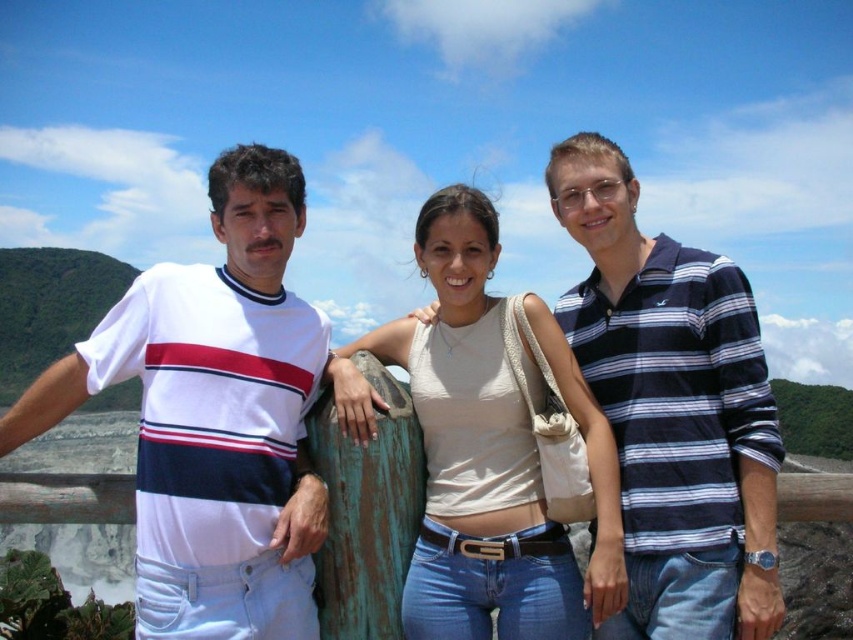
Does point (587, 580) come farther from viewer compared to point (608, 436)?

No.

Based on the photo, is beige fabric tank top at center positioned behind white striped shirt at center?

Yes, it is.

Does point (514, 406) come behind point (369, 429)?

Yes, it is.

Where is `beige fabric tank top at center`? The width and height of the screenshot is (853, 640). beige fabric tank top at center is located at coordinates (486, 451).

Between white striped t-shirt at left and beige fabric tank top at center, which one is positioned lower?

beige fabric tank top at center is below.

Measure the distance between white striped t-shirt at left and camera.

A distance of 27.30 meters exists between white striped t-shirt at left and camera.

Where is `white striped t-shirt at left`? This screenshot has width=853, height=640. white striped t-shirt at left is located at coordinates (213, 417).

Is white striped t-shirt at left wider than blue striped polo shirt at right?

Indeed, white striped t-shirt at left has a greater width compared to blue striped polo shirt at right.

Between white striped t-shirt at left and blue striped polo shirt at right, which one has less height?

Standing shorter between the two is blue striped polo shirt at right.

Is point (241, 474) behind point (752, 486)?

No.

You are a GUI agent. You are given a task and a screenshot of the screen. Output one action in this format:
    pyautogui.click(x=<x>, y=<y>)
    Task: Click on the white striped t-shirt at left
    This screenshot has width=853, height=640.
    Given the screenshot: What is the action you would take?
    pyautogui.click(x=213, y=417)